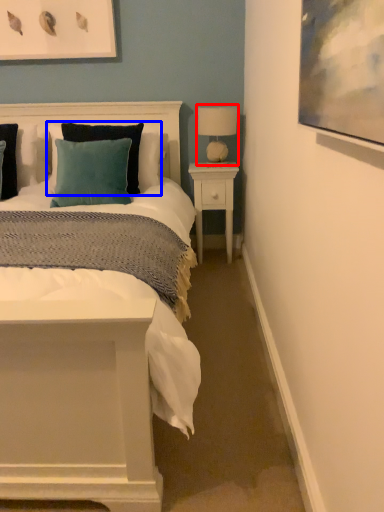
Question: Which point is closer to the camera, table lamp (highlighted by a red box) or pillow (highlighted by a blue box)?

Choices:
 (A) table lamp
 (B) pillow

Answer: (B)